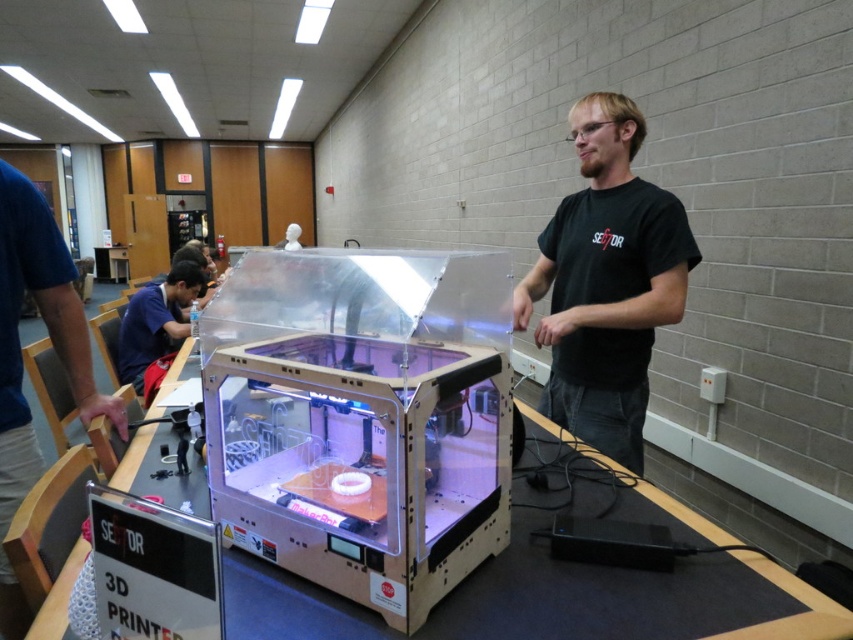
Can you confirm if blue fabric shirt at left is positioned to the left of matte blue shirt at left?

No, blue fabric shirt at left is not to the left of matte blue shirt at left.

Who is shorter, blue fabric shirt at left or matte blue shirt at left?

Standing shorter between the two is matte blue shirt at left.

This screenshot has height=640, width=853. I want to click on blue fabric shirt at left, so click(21, 356).

Where is `blue fabric shirt at left`? The width and height of the screenshot is (853, 640). blue fabric shirt at left is located at coordinates (21, 356).

Is black matte shirt at center thinner than blue fabric shirt at left?

No.

Does black matte shirt at center appear on the right side of blue fabric shirt at left?

Indeed, black matte shirt at center is positioned on the right side of blue fabric shirt at left.

This screenshot has width=853, height=640. Find the location of `black matte shirt at center`. black matte shirt at center is located at coordinates (606, 282).

Between black matte shirt at center and matte blue shirt at left, which one appears on the right side from the viewer's perspective?

black matte shirt at center is more to the right.

Does black matte shirt at center come behind matte blue shirt at left?

No.

Is point (621, 120) less distant than point (175, 333)?

Yes.

Where is `black matte shirt at center`? This screenshot has height=640, width=853. black matte shirt at center is located at coordinates (606, 282).